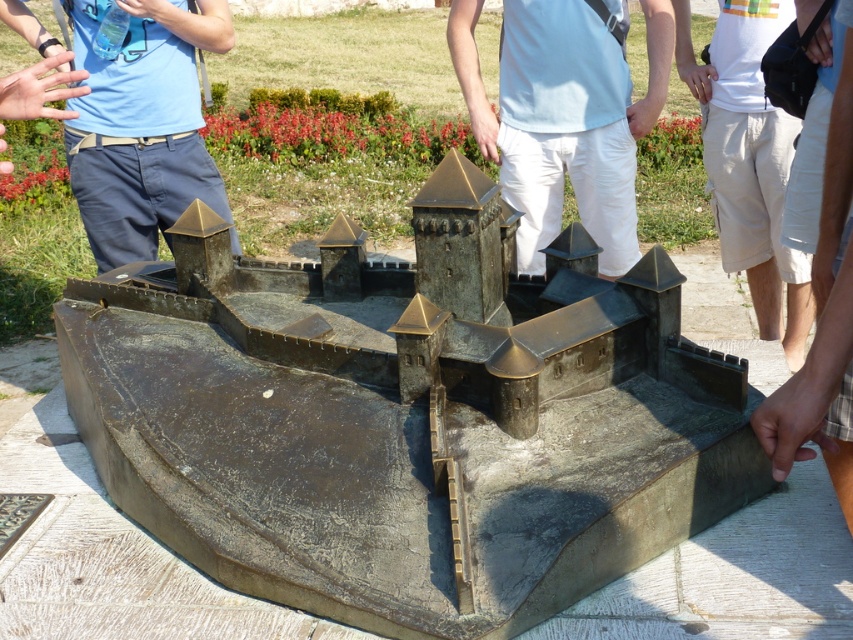
Locate an element on the screen. The width and height of the screenshot is (853, 640). bronze sculpture at center is located at coordinates (405, 419).

Image resolution: width=853 pixels, height=640 pixels. What do you see at coordinates (405, 419) in the screenshot? I see `bronze sculpture at center` at bounding box center [405, 419].

At what (x,y) coordinates should I click in order to perform the action: click on bronze sculpture at center. Please return your answer as a coordinate pair (x, y). This screenshot has width=853, height=640. Looking at the image, I should click on [405, 419].